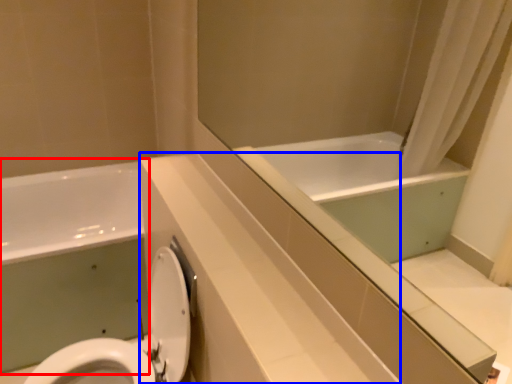
Question: Among these objects, which one is nearest to the camera, bath (highlighted by a red box) or counter top (highlighted by a blue box)?

Choices:
 (A) bath
 (B) counter top

Answer: (B)